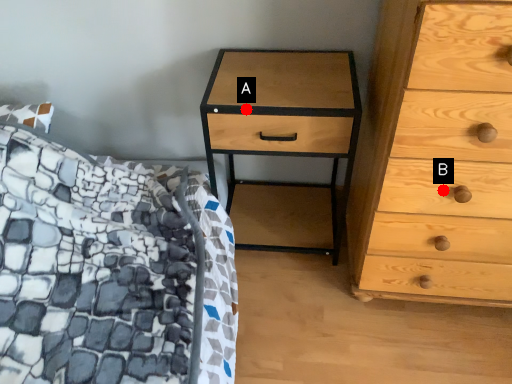
Question: Two points are circled on the image, labeled by A and B beside each circle. Which point appears farthest from the camera in this image?

Choices:
 (A) A is further
 (B) B is further

Answer: (A)